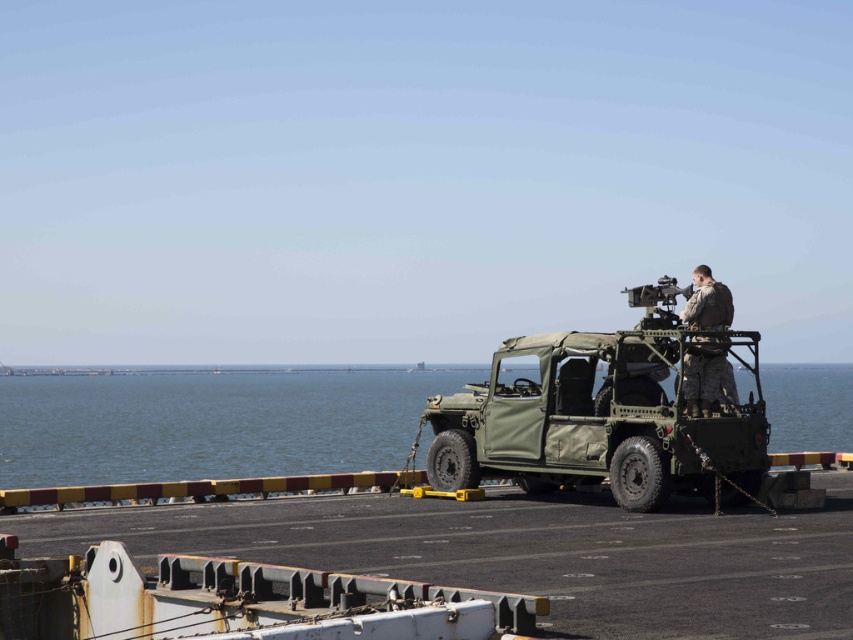
You are a drone operator controlling a surveillance drone. Your mission is to photograph two specific points on the naval ship deck. The first point is labeled as point (596, 412) and the second is point (711, 280). To ensure clear visibility, you need to capture both points in a single frame. Since the drone can only tilt its camera downward at a maximum angle of 45 degrees, which point should you prioritize photographing first to maintain the best visibility?

Point (596, 412) is closer to the viewer than point (711, 280). Since the drone can only tilt downward at a maximum angle of 45 degrees, prioritizing the closer point ensures better visibility and reduces the need for excessive tilting, thus maintaining image quality. Therefore, you should photograph point (596, 412) first.

You are a soldier on the deck of a naval ship. You need to move from your current position to the edge of the ship to secure a rope. The green matte water at center and the camouflage fabric uniform at center are in your path. How far apart are these two objects from each other?

The distance between the green matte water at center and the camouflage fabric uniform at center is 102.54 meters.